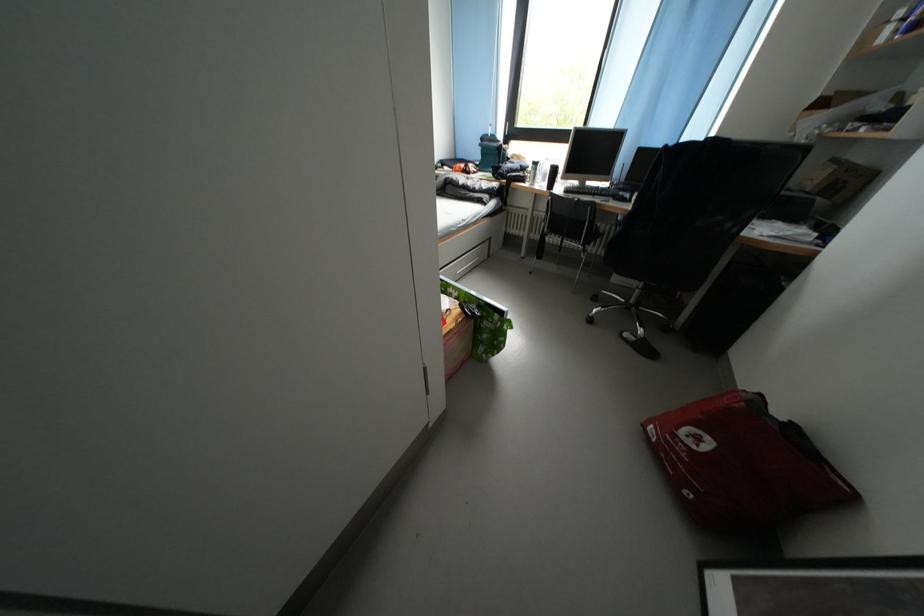
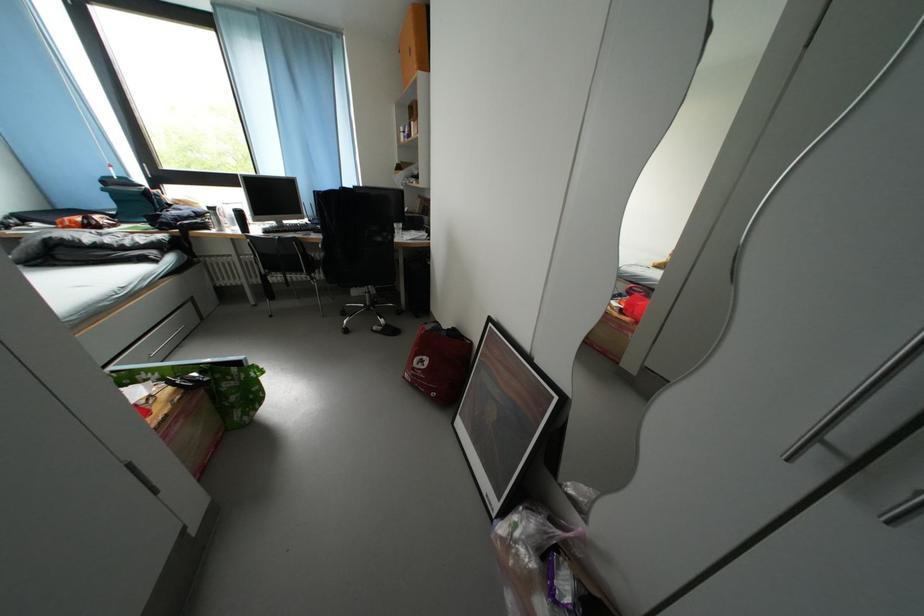
Find the pixel in the second image that matches (683,440) in the first image.

(421, 374)